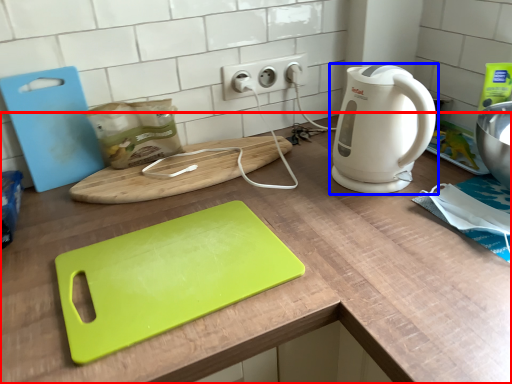
Question: Which of the following is the farthest to the observer, counter (highlighted by a red box) or home appliance (highlighted by a blue box)?

Choices:
 (A) counter
 (B) home appliance

Answer: (B)